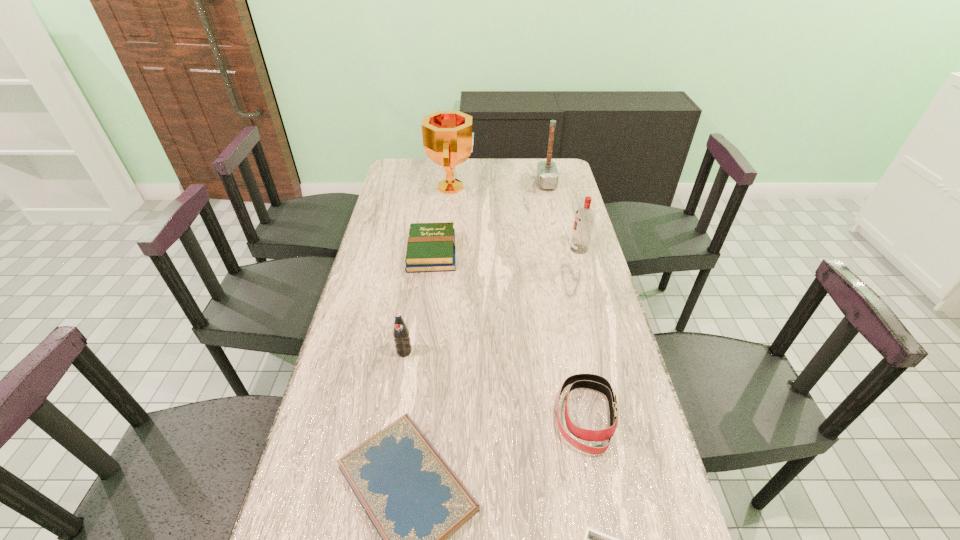
This screenshot has height=540, width=960. I want to click on award, so click(448, 140).

I want to click on hammer, so 547,174.

The width and height of the screenshot is (960, 540). Find the location of `vodka`. vodka is located at coordinates (584, 217).

Locate an element on the screen. This screenshot has width=960, height=540. pop is located at coordinates (403, 346).

Identify the location of the fifth farthest object. This screenshot has width=960, height=540. (403, 346).

Where is `dog collar`? The width and height of the screenshot is (960, 540). dog collar is located at coordinates (590, 381).

At what (x,y) coordinates should I click in order to perform the action: click on the taller book. Please return your answer as a coordinate pair (x, y). Looking at the image, I should click on (431, 247).

Where is `the left book`? The image size is (960, 540). the left book is located at coordinates (431, 247).

Locate an element on the screen. The image size is (960, 540). free space located on the side of the award with the star emblem is located at coordinates (539, 187).

This screenshot has width=960, height=540. I want to click on vacant space located 0.220m on the striking surface of the hammer, so click(488, 183).